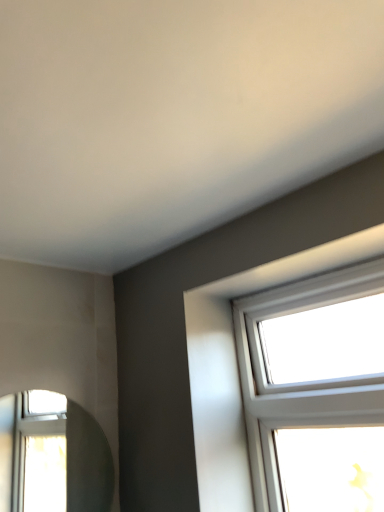
What do you see at coordinates (53, 459) in the screenshot?
I see `clear glass window at lower left` at bounding box center [53, 459].

Identify the location of clear glass window at lower left. Image resolution: width=384 pixels, height=512 pixels. (53, 459).

Measure the distance between clear glass window at lower left and camera.

clear glass window at lower left is 8.05 feet from camera.

I want to click on clear glass window at lower left, so click(x=53, y=459).